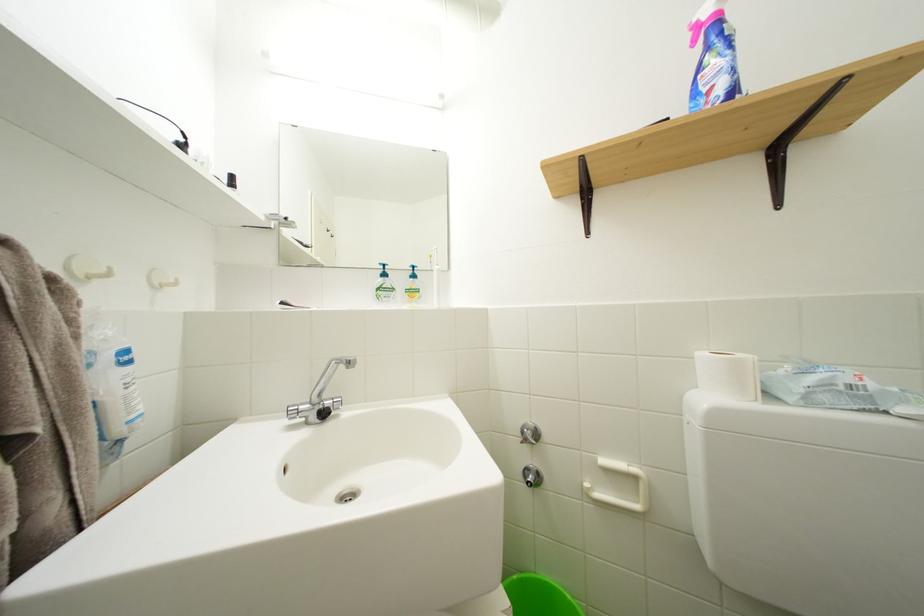
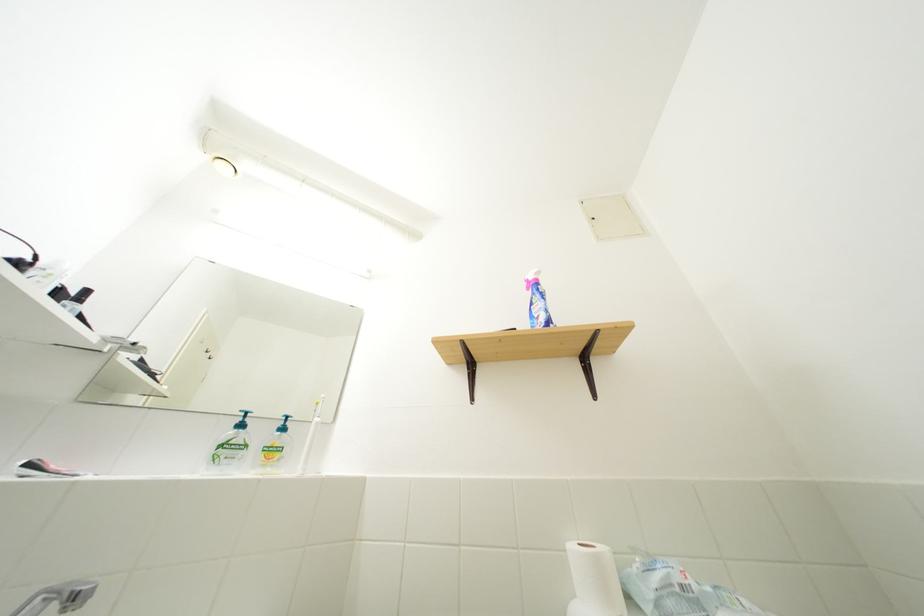
In the second image, find the point that corresponds to point 821,385 in the first image.

(665, 585)